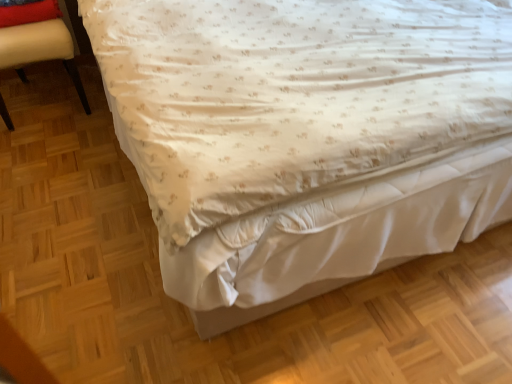
What do you see at coordinates (37, 40) in the screenshot?
I see `beige leather chair at left` at bounding box center [37, 40].

The width and height of the screenshot is (512, 384). I want to click on beige leather chair at left, so click(x=37, y=40).

What do you see at coordinates (29, 13) in the screenshot? This screenshot has width=512, height=384. I see `red velvet pillow at upper left` at bounding box center [29, 13].

This screenshot has height=384, width=512. What are the coordinates of `red velvet pillow at upper left` in the screenshot? It's located at (29, 13).

Locate an element on the screen. The height and width of the screenshot is (384, 512). beige leather chair at left is located at coordinates (37, 40).

Between red velvet pillow at upper left and beige leather chair at left, which one appears on the left side from the viewer's perspective?

beige leather chair at left.

In the scene shown: Is the position of red velvet pillow at upper left more distant than that of beige leather chair at left?

Yes, red velvet pillow at upper left is behind beige leather chair at left.

Is point (0, 23) in front of point (82, 100)?

Yes, point (0, 23) is closer to viewer.

From the image's perspective, is red velvet pillow at upper left located above or below beige leather chair at left?

From the image's perspective, red velvet pillow at upper left appears above beige leather chair at left.

From a real-world perspective, is red velvet pillow at upper left located beneath beige leather chair at left?

Incorrect, from a real-world perspective, red velvet pillow at upper left is higher than beige leather chair at left.

Is red velvet pillow at upper left wider or thinner than beige leather chair at left?

In the image, red velvet pillow at upper left appears to be more narrow than beige leather chair at left.

Is red velvet pillow at upper left shorter than beige leather chair at left?

Yes.

Considering the relative sizes of red velvet pillow at upper left and beige leather chair at left in the image provided, is red velvet pillow at upper left smaller than beige leather chair at left?

Yes, red velvet pillow at upper left is smaller than beige leather chair at left.

Is red velvet pillow at upper left located outside beige leather chair at left?

No, red velvet pillow at upper left is not entirely external to beige leather chair at left.

Is red velvet pillow at upper left far away from beige leather chair at left?

red velvet pillow at upper left is actually quite close to beige leather chair at left.

Is red velvet pillow at upper left oriented away from beige leather chair at left?

Yes, red velvet pillow at upper left is positioned with its back facing beige leather chair at left.

Identify the location of pillow that is above the beige leather chair at left (from a real-world perspective). (29, 13).

Considering the relative positions of beige leather chair at left and red velvet pillow at upper left in the image provided, is beige leather chair at left to the left or to the right of red velvet pillow at upper left?

From the image, it's evident that beige leather chair at left is to the left of red velvet pillow at upper left.

From the picture: Does beige leather chair at left lie behind red velvet pillow at upper left?

No, beige leather chair at left is closer to the viewer.

Is point (20, 73) in front of point (54, 8)?

No, it is not.

From the image's perspective, which one is positioned lower, beige leather chair at left or red velvet pillow at upper left?

beige leather chair at left.

From a real-world perspective, between beige leather chair at left and red velvet pillow at upper left, who is vertically lower?

beige leather chair at left is physically lower.

Between beige leather chair at left and red velvet pillow at upper left, which one has smaller width?

red velvet pillow at upper left is thinner.

Based on the photo, who is shorter, beige leather chair at left or red velvet pillow at upper left?

With less height is red velvet pillow at upper left.

Does beige leather chair at left have a larger size compared to red velvet pillow at upper left?

Yes, beige leather chair at left is bigger than red velvet pillow at upper left.

Would you say beige leather chair at left is outside red velvet pillow at upper left?

Absolutely, beige leather chair at left is external to red velvet pillow at upper left.

Does beige leather chair at left touch red velvet pillow at upper left?

Yes.

Is beige leather chair at left turned away from red velvet pillow at upper left?

No, beige leather chair at left is not facing away from red velvet pillow at upper left.

Can you tell me how much beige leather chair at left and red velvet pillow at upper left differ in facing direction?

The facing directions of beige leather chair at left and red velvet pillow at upper left are 0.449 degrees apart.

You are a GUI agent. You are given a task and a screenshot of the screen. Output one action in this format:
    pyautogui.click(x=<x>, y=<y>)
    Task: Click on the pillow to the right of beige leather chair at left
    The height and width of the screenshot is (384, 512).
    Given the screenshot: What is the action you would take?
    pyautogui.click(x=29, y=13)

Where is `pillow that appears behind the beige leather chair at left`? Image resolution: width=512 pixels, height=384 pixels. pillow that appears behind the beige leather chair at left is located at coordinates (29, 13).

In order to click on pillow on the right of beige leather chair at left in this screenshot , I will do `click(29, 13)`.